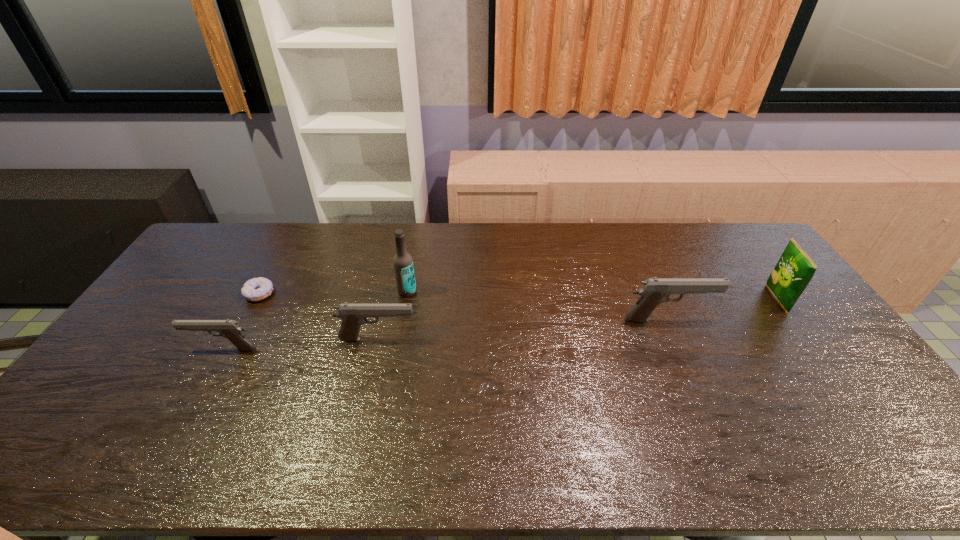
Image resolution: width=960 pixels, height=540 pixels. What are the coordinates of `the nearest object` in the screenshot? It's located at (230, 329).

I want to click on the nearest pistol, so click(230, 329).

Where is `the second pistol from left to right`? The width and height of the screenshot is (960, 540). the second pistol from left to right is located at coordinates (353, 316).

Where is `the second nearest object`? Image resolution: width=960 pixels, height=540 pixels. the second nearest object is located at coordinates (353, 316).

The height and width of the screenshot is (540, 960). What are the coordinates of `the farthest pistol` in the screenshot? It's located at (x=654, y=291).

Identify the location of the rightmost pistol. The image size is (960, 540). (654, 291).

This screenshot has height=540, width=960. What are the coordinates of `beer bottle` in the screenshot? It's located at (403, 263).

Identify the location of the rightmost object. (793, 272).

What are the coordinates of `the shortest object` in the screenshot? It's located at (256, 289).

The image size is (960, 540). I want to click on free region located at the barrel of the nearest object, so click(124, 349).